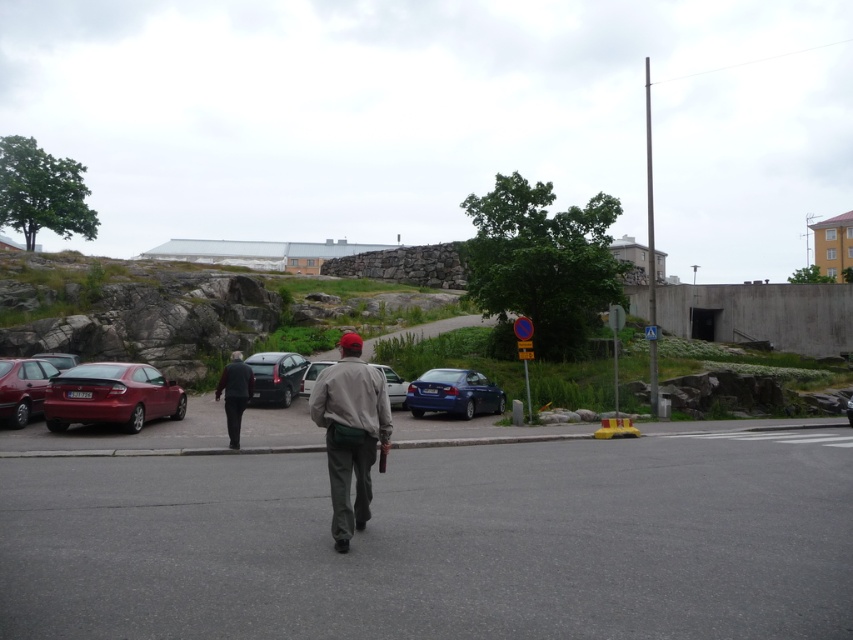
Question: Can you confirm if dark gray fabric pants at center is smaller than matte red car at left?

Choices:
 (A) no
 (B) yes

Answer: (A)

Question: Can you confirm if matte red car at left is positioned below metallic blue sedan at center?

Choices:
 (A) yes
 (B) no

Answer: (B)

Question: Where is matte blue sedan at center located in relation to satin black car at center in the image?

Choices:
 (A) below
 (B) above

Answer: (A)

Question: Which of the following is the farthest from the observer?

Choices:
 (A) (280, 401)
 (B) (21, 408)

Answer: (A)

Question: Which object is positioned closest to the gray fabric jacket at center?

Choices:
 (A) shiny silver sedan at center
 (B) shiny red car at left
 (C) dark gray fabric pants at center
 (D) matte blue sedan at center

Answer: (C)

Question: Based on their relative distances, which object is farther from the shiny silver sedan at center?

Choices:
 (A) metallic blue sedan at center
 (B) shiny red sedan at left
 (C) matte blue sedan at center
 (D) matte red car at left

Answer: (A)